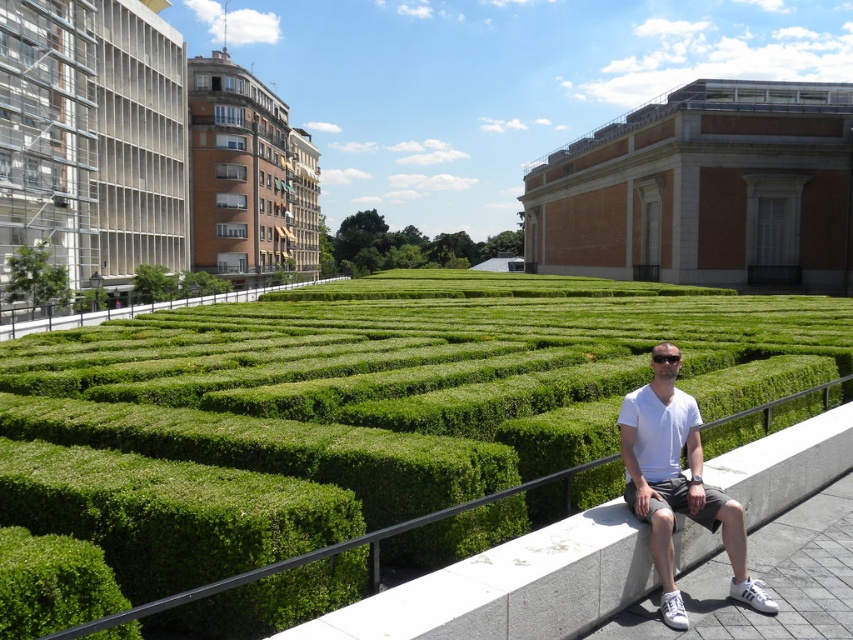
You are standing in the hedge maze and see the green leafy bush at lower left and the green leafy bush at center. Which one is positioned more to the right side of the maze?

The green leafy bush at lower left is positioned more to the right side of the maze because it is to the right of the green leafy bush at center.

You are standing in the middle of the hedge maze and want to exit. The green leafy bush at lower left is blocking your path. Can you walk around it without getting too close?

The green leafy bush at lower left is 4.95 meters away from camera, so you can walk around it while maintaining a safe distance.

You are standing in the middle of the green hedge maze at center. Looking out, you see the modern building with a glass facade on the left and the classical building with columns on the right. Which direction should you walk to exit the maze and reach the classical building with columns?

To exit the maze and reach the classical building with columns on the right, you should walk towards the right side since the classical building is located to the right of the green hedge maze at center.